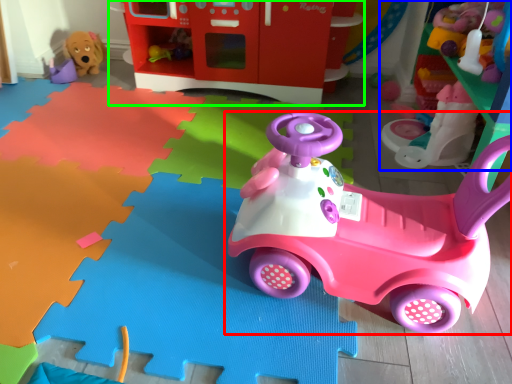
Question: Estimate the real-world distances between objects in this image. Which object is closer to toy (highlighted by a red box), toy (highlighted by a blue box) or toy (highlighted by a green box)?

Choices:
 (A) toy
 (B) toy

Answer: (A)